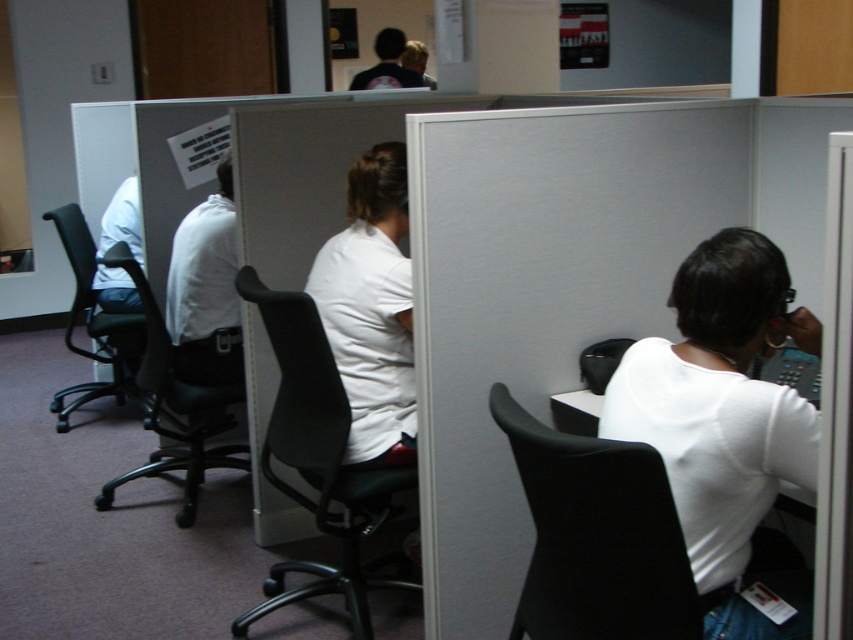
You are standing at the entrance of the office and notice a point marked at coordinates (724, 420). What object is located at this point?

The white matte shirt at right is located at point (724, 420).

You are an office worker who needs to move a box from the desk to the storage room. The path between your desk and the storage room is narrow, only 1.2 meters wide. You are currently sitting in the black matte swivel chair at lower right. Can you move the chair through the path without hitting the black leather swivel chair at center?

The black matte swivel chair at lower right has a lesser width compared to the black leather swivel chair at center. Since the path is 1.2 meters wide, and the black matte swivel chair at lower right is narrower, it should fit through the path without hitting the black leather swivel chair at center.